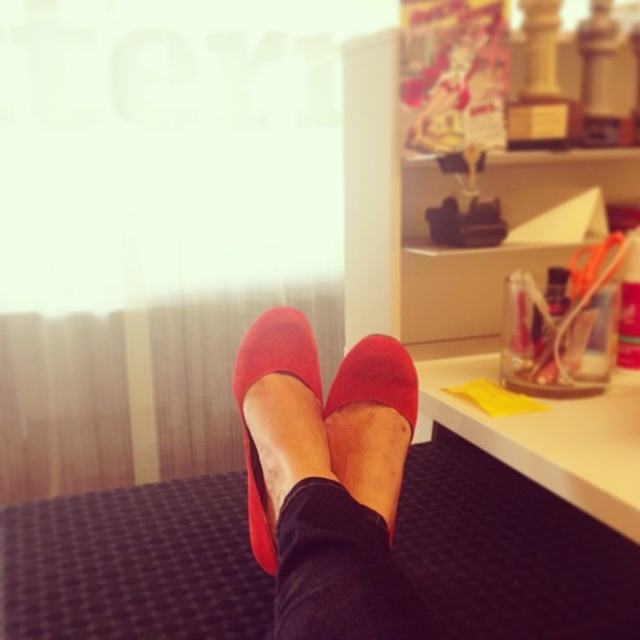
You are an interior designer planning to place a small plant pot in this room. The plant pot requires a space that is 0.5 meters wide. Considering the suede red shoes at center, which are located at point 0.756, 0.516, can you place the plant pot here without overlapping the shoes?

The suede red shoes at center are located at point (330, 483). Since the plant pot requires 0.5 meters of space, you need to ensure the coordinates do not overlap. However, without knowing the exact dimensions of the room or the shoes, it is impossible to determine if the plant pot can be placed safely here.